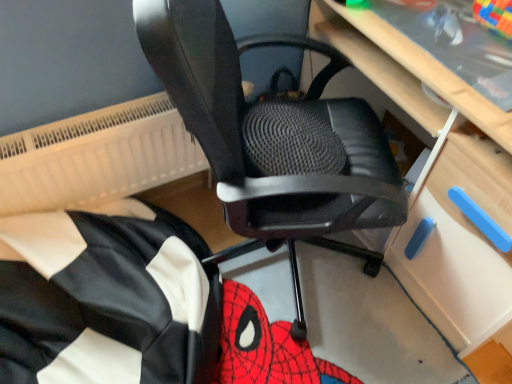
Question: From the image's perspective, is light wood computer desk at center on black mesh office chair at center?

Choices:
 (A) no
 (B) yes

Answer: (B)

Question: Does light wood computer desk at center have a greater width compared to black mesh office chair at center?

Choices:
 (A) no
 (B) yes

Answer: (A)

Question: Is light wood computer desk at center thinner than black mesh office chair at center?

Choices:
 (A) yes
 (B) no

Answer: (A)

Question: Is light wood computer desk at center further to the viewer compared to black mesh office chair at center?

Choices:
 (A) no
 (B) yes

Answer: (B)

Question: Is light wood computer desk at center far from black mesh office chair at center?

Choices:
 (A) yes
 (B) no

Answer: (B)

Question: Considering their positions, is white textured radiator at upper left located in front of or behind black fabric bean bag at lower left?

Choices:
 (A) behind
 (B) front

Answer: (A)

Question: Is white textured radiator at upper left spatially inside black fabric bean bag at lower left, or outside of it?

Choices:
 (A) inside
 (B) outside

Answer: (B)

Question: From the image's perspective, is white textured radiator at upper left positioned above or below black fabric bean bag at lower left?

Choices:
 (A) above
 (B) below

Answer: (A)

Question: In the image, is white textured radiator at upper left on the left side or the right side of black fabric bean bag at lower left?

Choices:
 (A) right
 (B) left

Answer: (B)

Question: Looking at their shapes, would you say light wood computer desk at center is wider or thinner than black mesh office chair at center?

Choices:
 (A) wide
 (B) thin

Answer: (B)

Question: Is point (446, 188) closer or farther from the camera than point (209, 157)?

Choices:
 (A) farther
 (B) closer

Answer: (A)

Question: Looking at the image, does light wood computer desk at center seem bigger or smaller compared to black mesh office chair at center?

Choices:
 (A) big
 (B) small

Answer: (A)

Question: From a real-world perspective, is light wood computer desk at center positioned above or below black mesh office chair at center?

Choices:
 (A) above
 (B) below

Answer: (B)

Question: Is black mesh office chair at center wider or thinner than black fabric bean bag at lower left?

Choices:
 (A) wide
 (B) thin

Answer: (B)

Question: From a real-world perspective, is black mesh office chair at center physically located above or below black fabric bean bag at lower left?

Choices:
 (A) below
 (B) above

Answer: (B)